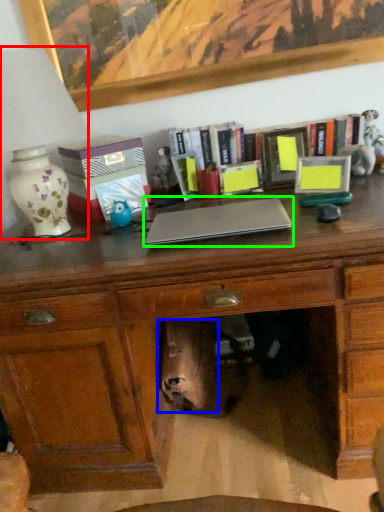
Question: Based on their relative distances, which object is nearer to table lamp (highlighted by a red box)? Choose from animal (highlighted by a blue box) and laptop (highlighted by a green box).

Choices:
 (A) animal
 (B) laptop

Answer: (B)